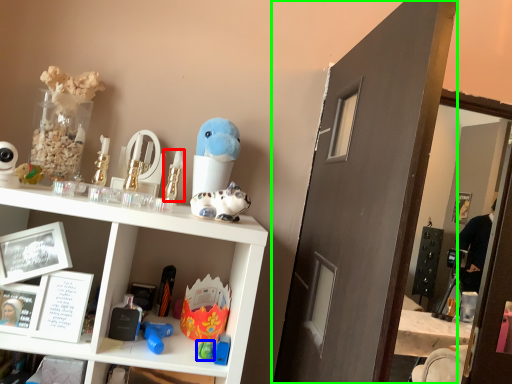
Question: Which object is the closest to the toy (highlighted by a red box)? Choose among these: toy (highlighted by a blue box) or glass door (highlighted by a green box).

Choices:
 (A) toy
 (B) glass door

Answer: (A)